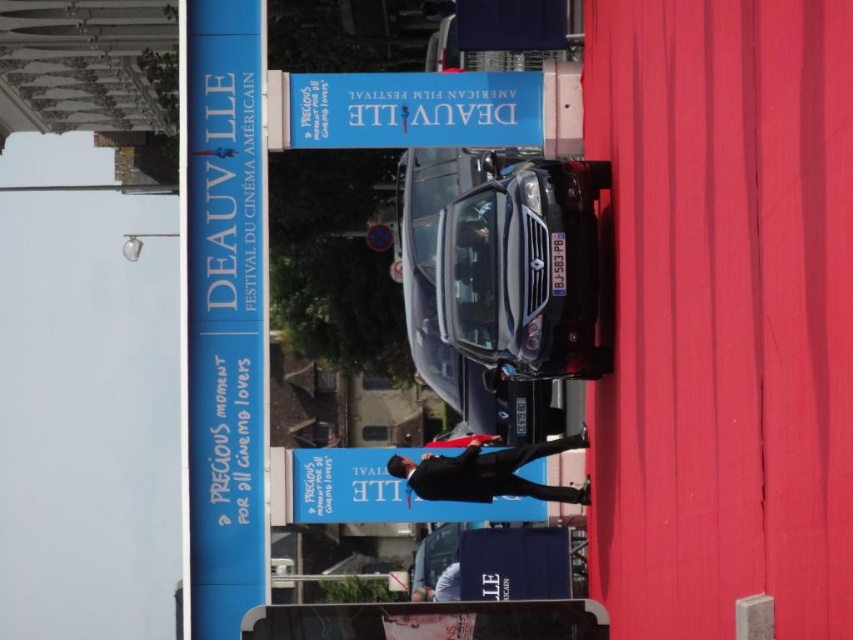
You are a photographer at the Deauville American Film Festival. You need to capture a photo of the blue fabric sign at center without the blue plastic signboard at center blocking it. Which direction should you move your camera to achieve this?

The blue plastic signboard at center is closer to you than the blue fabric sign at center. To avoid the plastic signboard blocking the fabric sign, move your camera slightly backward so that the fabric sign comes into view behind the plastic signboard.